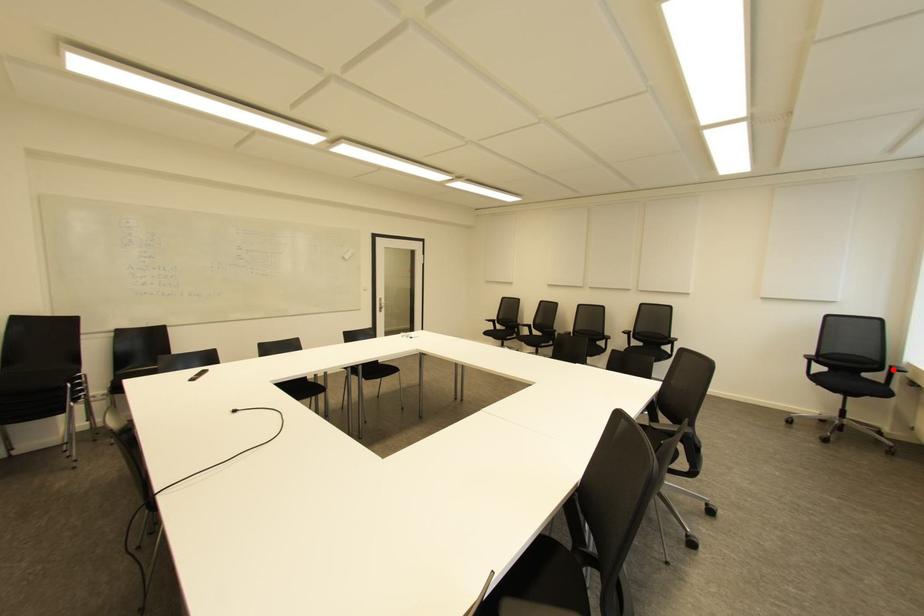
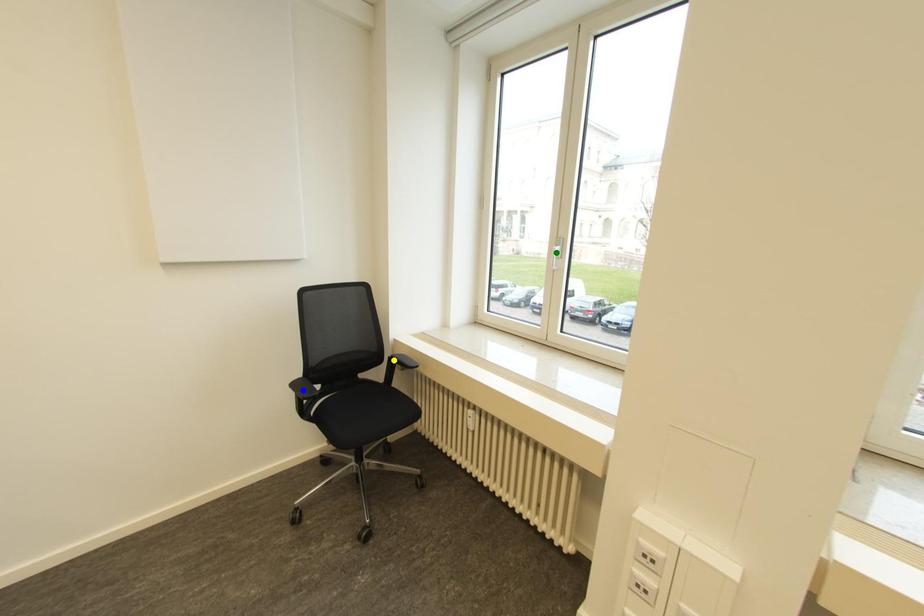
Question: I am providing you with two images of the same scene from different viewpoints. A red point is marked on the first image. You are given multiple points on the second image. Can you choose the point in image 2 that corresponds to the point in image 1?

Choices:
 (A) blue point
 (B) green point
 (C) yellow point

Answer: (C)